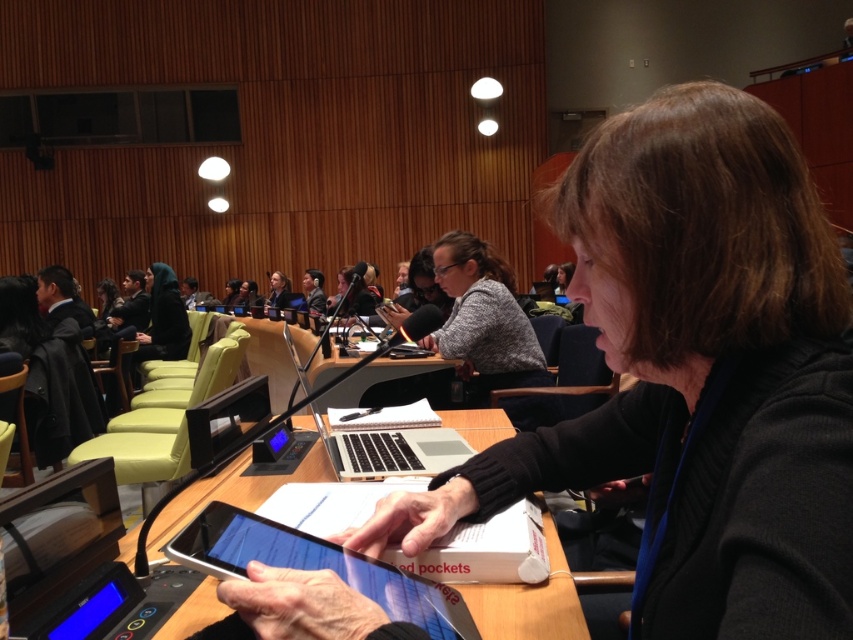
Which is behind, point (459, 637) or point (502, 324)?

Point (502, 324)

Is black glossy tablet at center smaller than gray knit sweater at center?

Yes.

Which is in front, point (457, 602) or point (486, 394)?

Point (457, 602) is more forward.

Find the location of a particular element. black glossy tablet at center is located at coordinates click(x=317, y=566).

Is silver/black matte laptop at center closer to the viewer compared to dark gray fabric hijab at center?

Yes, it is in front of dark gray fabric hijab at center.

The width and height of the screenshot is (853, 640). Find the location of `silver/black matte laptop at center`. silver/black matte laptop at center is located at coordinates (390, 451).

Does point (546, 385) come farther from viewer compared to point (61, 266)?

No, (546, 385) is in front of (61, 266).

Which is behind, point (505, 385) or point (61, 280)?

The point (61, 280) is more distant.

Which is in front, point (486, 296) or point (90, 316)?

Point (486, 296) is in front.

Where is `gray knit sweater at center`? The image size is (853, 640). gray knit sweater at center is located at coordinates (483, 317).